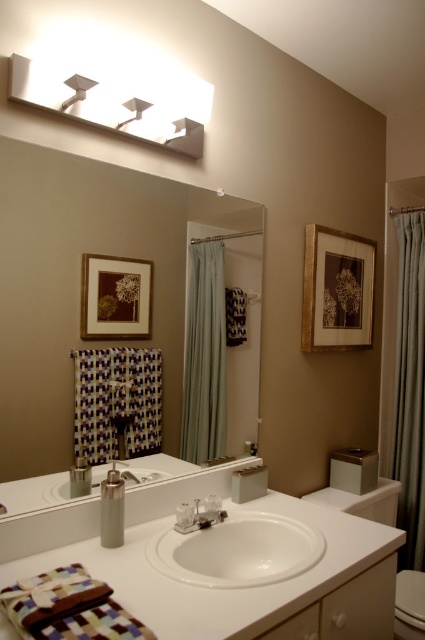
You are a home inspector assessing the bathroom layout. You need to determine the vertical positioning of the clear glass mirror at center and the white matte light fixture at upper center. Based on the scene, which object is placed higher?

The white matte light fixture at upper center is placed higher than the clear glass mirror at center, as it is positioned above the mirror.

You are designing a bathroom layout and need to ensure that the white glossy sink at center is proportionate to the white matte light fixture at upper center. Given that the light fixture is larger, which object should you consider resizing to maintain balance?

The white glossy sink at center should be resized to be larger to match the scale of the white matte light fixture at upper center, ensuring visual balance in the bathroom layout.